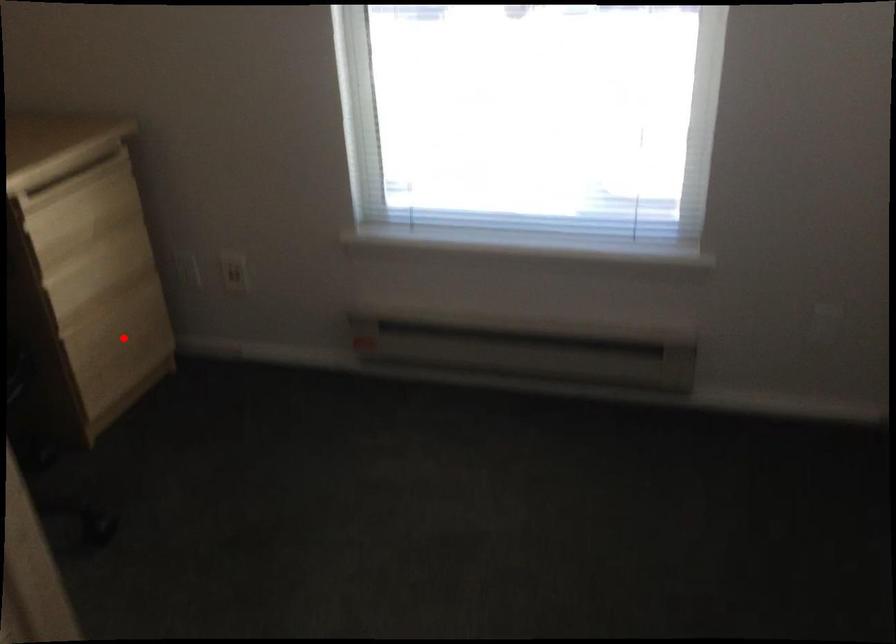
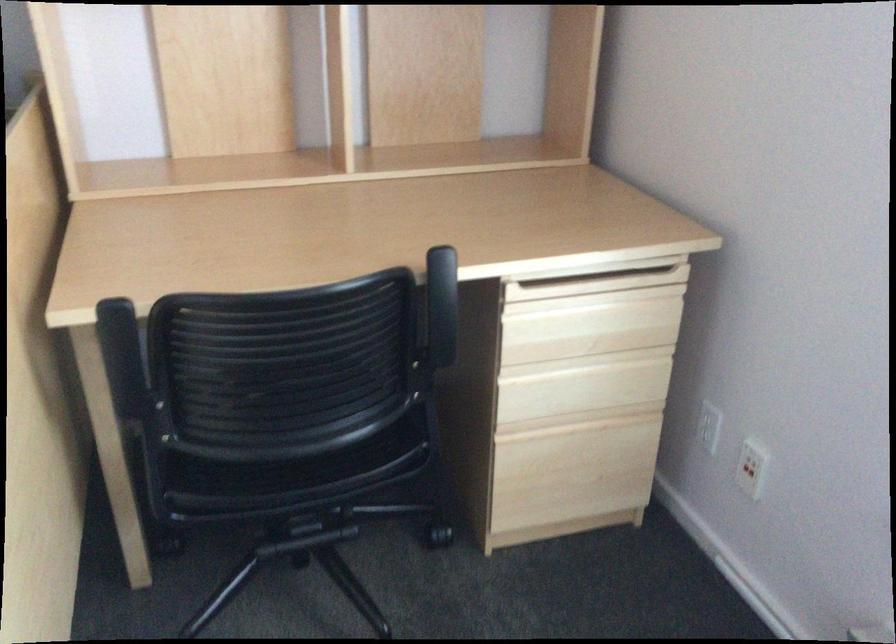
Question: I am providing you with two images of the same scene from different viewpoints. In image1, a red point is highlighted. Considering the same 3D point in image2, which of the following is correct?

Choices:
 (A) It is closer
 (B) It is farther

Answer: (A)